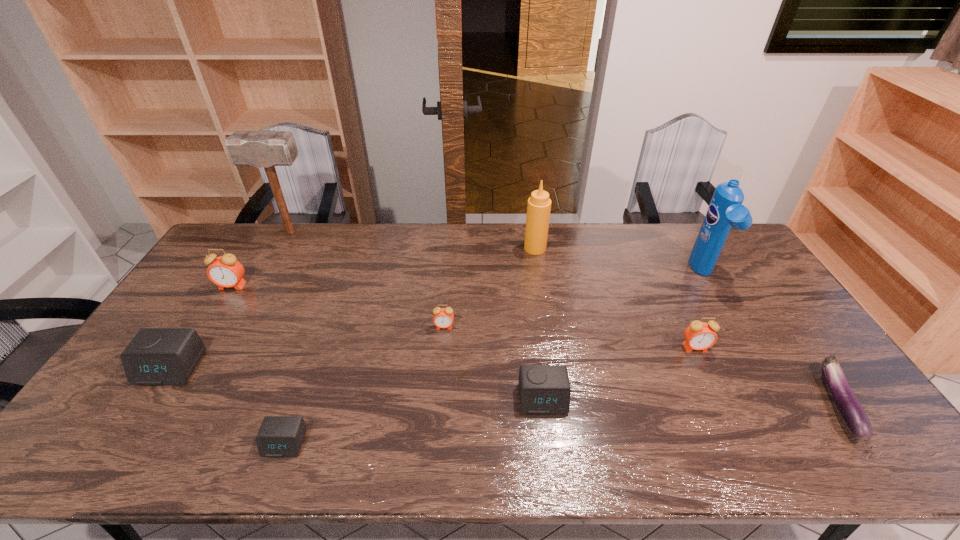
Identify the location of free space located on the left of the eighth shortest object. (461, 248).

Locate an element on the screen. vacant space situated on the face of the seventh shortest object is located at coordinates (182, 364).

Where is `free region located on the face of the rightmost pink alarm clock`? free region located on the face of the rightmost pink alarm clock is located at coordinates (706, 370).

Locate an element on the screen. vacant space located on the front-facing side of the leftmost black alarm clock is located at coordinates (113, 456).

This screenshot has height=540, width=960. I want to click on free space located 0.230m on the face of the second nearest pink alarm clock, so click(x=439, y=397).

Find the location of `vacant region located 0.120m on the front-facing side of the second alarm clock from right to left`. vacant region located 0.120m on the front-facing side of the second alarm clock from right to left is located at coordinates 551,462.

This screenshot has height=540, width=960. What are the coordinates of `vacant region located on the left of the rightmost object` in the screenshot? It's located at (747, 402).

Identify the location of mallet located at the far edge. This screenshot has width=960, height=540. (266, 149).

Where is `shampoo present at the far edge`? The image size is (960, 540). shampoo present at the far edge is located at coordinates (725, 210).

Where is `condiment at the far edge`? This screenshot has width=960, height=540. condiment at the far edge is located at coordinates (539, 204).